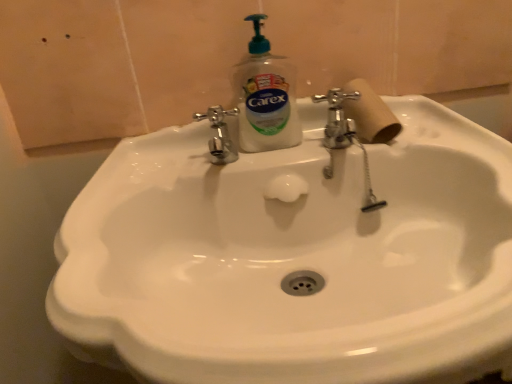
Question: Considering their positions, is clear plastic soap dispenser at center located in front of or behind wooden at right?

Choices:
 (A) behind
 (B) front

Answer: (B)

Question: Visually, is clear plastic soap dispenser at center positioned to the left or to the right of wooden at right?

Choices:
 (A) left
 (B) right

Answer: (A)

Question: Estimate the real-world distances between objects in this image. Which object is farther from the white glossy sink at center?

Choices:
 (A) wooden at right
 (B) clear plastic soap dispenser at center

Answer: (A)

Question: Which of these objects is positioned farthest from the white glossy sink at center?

Choices:
 (A) clear plastic soap dispenser at center
 (B) wooden at right

Answer: (B)